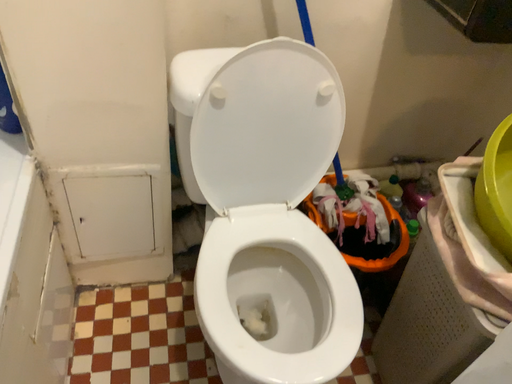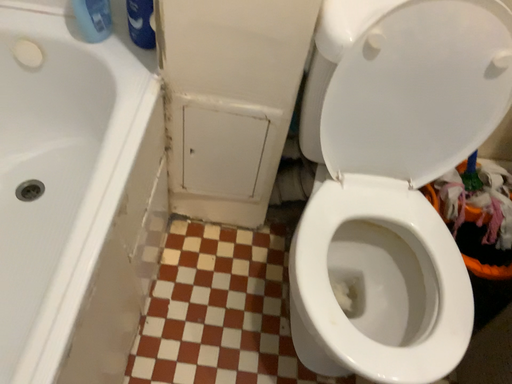
Question: How did the camera likely rotate when shooting the video?

Choices:
 (A) rotated left
 (B) rotated right

Answer: (A)